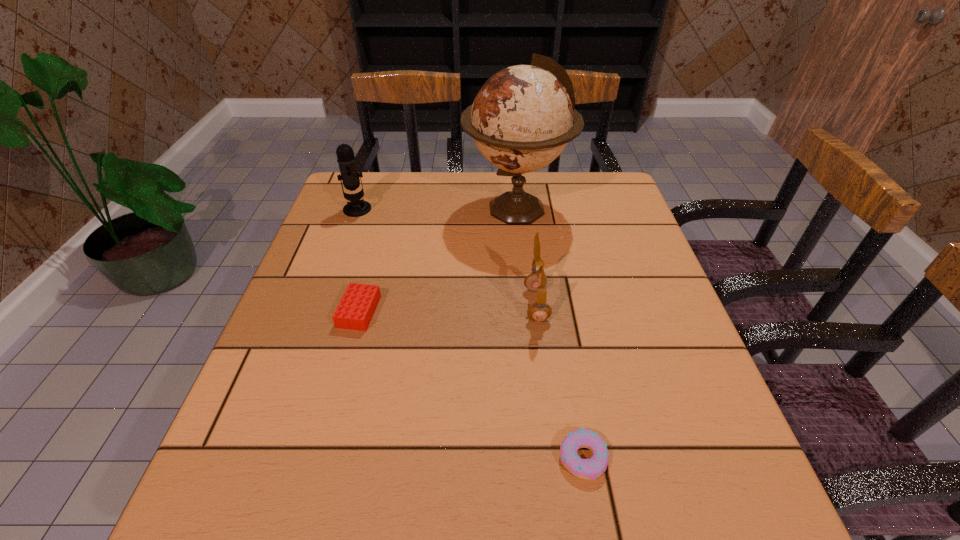
Find the location of a particular element. globe is located at coordinates (522, 118).

Locate an element on the screen. the leftmost object is located at coordinates [x=346, y=160].

Where is `microphone`? This screenshot has height=540, width=960. microphone is located at coordinates (346, 160).

Where is `the third tallest object`? The height and width of the screenshot is (540, 960). the third tallest object is located at coordinates (536, 281).

You are a GUI agent. You are given a task and a screenshot of the screen. Output one action in this format:
    pyautogui.click(x=<x>, y=<y>)
    Task: Click on the fourth tallest object
    This screenshot has height=540, width=960.
    Given the screenshot: What is the action you would take?
    pyautogui.click(x=357, y=306)

Image resolution: width=960 pixels, height=540 pixels. In order to click on Lego in this screenshot , I will do `click(357, 306)`.

Image resolution: width=960 pixels, height=540 pixels. Identify the location of the shortest object. (590, 469).

The image size is (960, 540). In order to click on the nearest object in this screenshot , I will do `click(590, 469)`.

Find the location of a particular element. Image resolution: width=960 pixels, height=540 pixels. free space located on the front of the globe showing Asia is located at coordinates (414, 208).

The image size is (960, 540). I want to click on vacant space positioned 0.380m on the front of the globe showing Asia, so click(x=330, y=208).